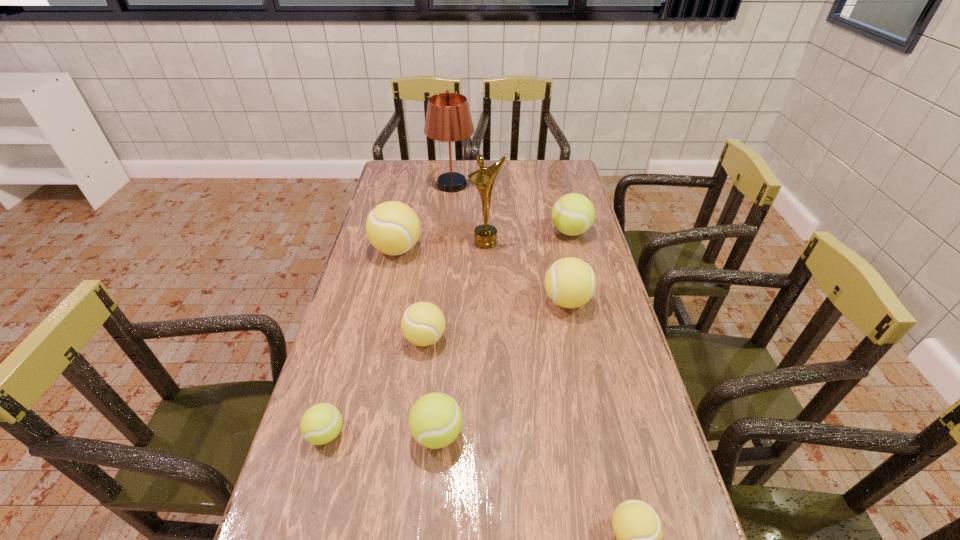
Choose which tennis ball is the nearest neighbor to the farthest yellow tennis ball. Please provide its 2D coordinates. Your answer should be formatted as a tuple, i.e. [(x, y)], where the tuple contains the x and y coordinates of a point satisfying the conditions above.

[(423, 323)]

What are the coordinates of `yellow tennis ball that is the second closest to the nearest object` in the screenshot? It's located at (570, 282).

Identify which yellow tennis ball is located as the fourth nearest to the rightmost green tennis ball. Please provide its 2D coordinates. Your answer should be formatted as a tuple, i.e. [(x, y)], where the tuple contains the x and y coordinates of a point satisfying the conditions above.

[(637, 527)]

Identify which green tennis ball is located as the second nearest to the second green tennis ball from left to right. Please provide its 2D coordinates. Your answer should be formatted as a tuple, i.e. [(x, y)], where the tuple contains the x and y coordinates of a point satisfying the conditions above.

[(573, 214)]

Select which green tennis ball appears as the second closest to the farthest green tennis ball. Please provide its 2D coordinates. Your answer should be formatted as a tuple, i.e. [(x, y)], where the tuple contains the x and y coordinates of a point satisfying the conditions above.

[(320, 424)]

At what (x,y) coordinates should I click in order to perform the action: click on free space that satisfies the following two spatial constraints: 1. on the front-facing side of the farthest object; 2. on the front side of the third tallest object. Please return your answer as a coordinate pair (x, y). Looking at the image, I should click on (449, 249).

At what (x,y) coordinates should I click in order to perform the action: click on free space that satisfies the following two spatial constraints: 1. on the back side of the third nearest yellow tennis ball; 2. on the right side of the second green tennis ball from left to right. Please return your answer as a coordinate pair (x, y). The height and width of the screenshot is (540, 960). Looking at the image, I should click on (447, 301).